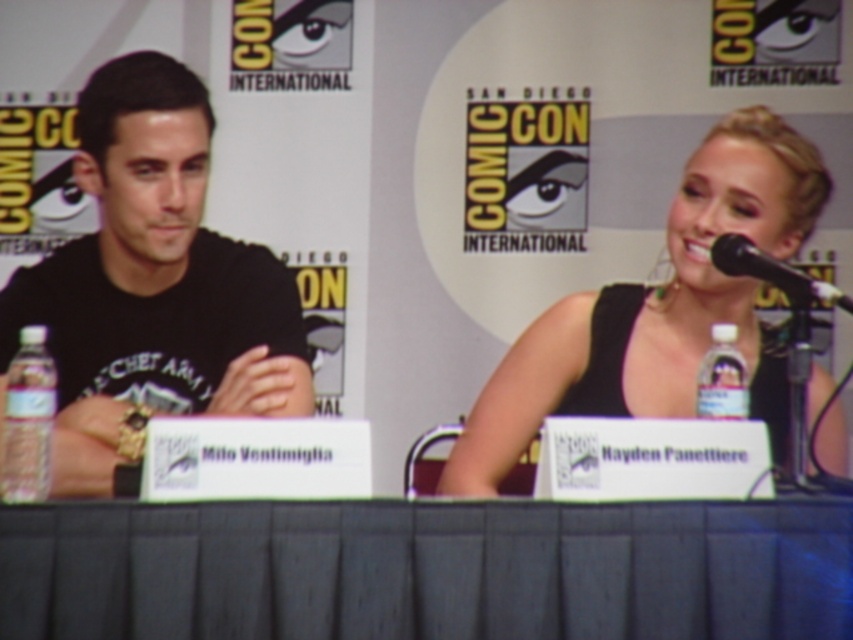
Question: Is clear plastic bottle at left positioned behind clear plastic bottle at center?

Choices:
 (A) no
 (B) yes

Answer: (A)

Question: Can you confirm if clear plastic bottle at left is wider than black plastic microphone at upper right?

Choices:
 (A) yes
 (B) no

Answer: (B)

Question: In this image, where is black satin dress at upper right located relative to clear plastic bottle at center?

Choices:
 (A) left
 (B) right

Answer: (A)

Question: Which of the following is the closest to the observer?

Choices:
 (A) clear plastic bottle at left
 (B) black fabric table at center

Answer: (B)

Question: Which point is closer to the camera taking this photo?

Choices:
 (A) (595, 509)
 (B) (712, 404)

Answer: (A)

Question: Among these points, which one is farthest from the camera?

Choices:
 (A) (711, 259)
 (B) (115, 529)
 (C) (231, 308)

Answer: (C)